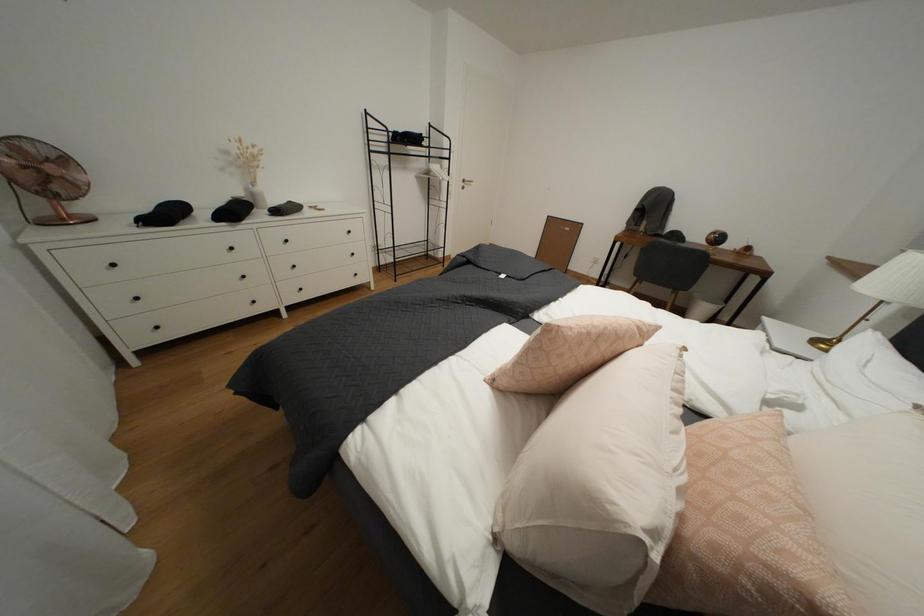
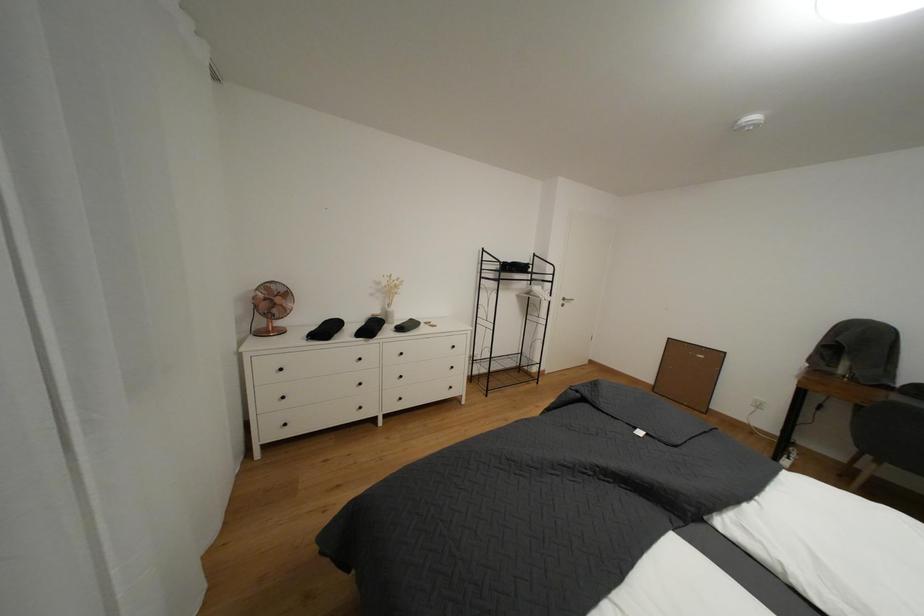
Question: In a continuous first-person perspective shot, in which direction is the camera moving?

Choices:
 (A) Left
 (B) Right
 (C) Forward
 (D) Backward

Answer: (A)